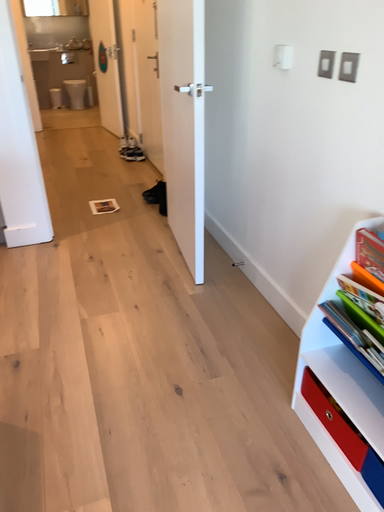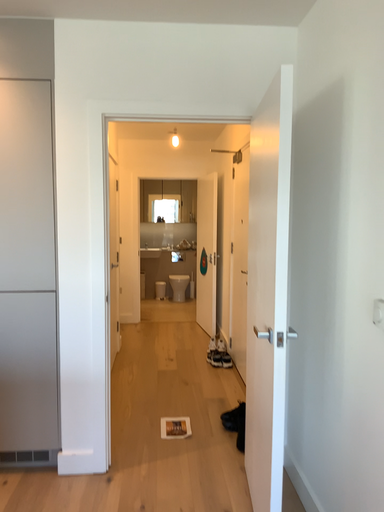
Question: How did the camera likely rotate when shooting the video?

Choices:
 (A) rotated downward
 (B) rotated upward

Answer: (B)